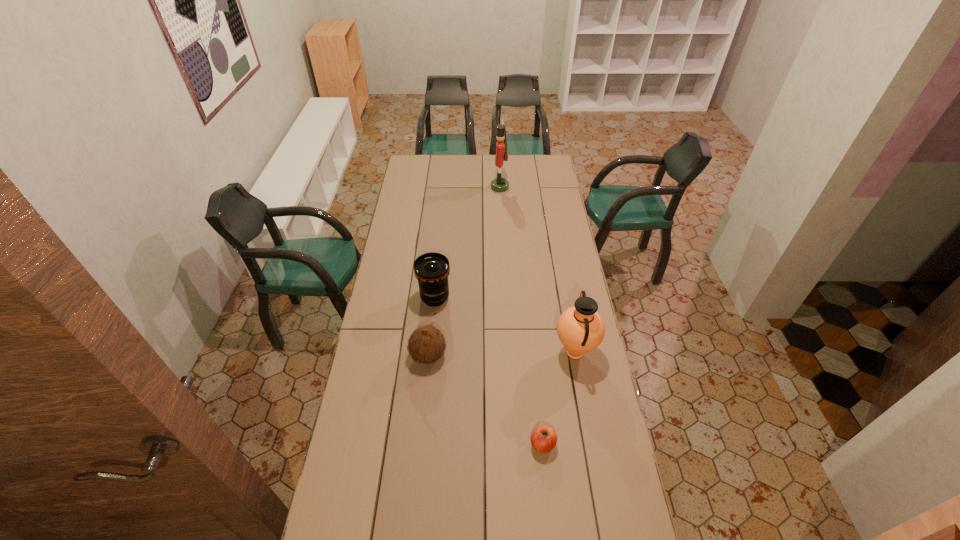
Where is `vacant region located on the front-facing side of the nutcracker`? The height and width of the screenshot is (540, 960). vacant region located on the front-facing side of the nutcracker is located at coordinates (434, 187).

Where is `vacant space located 0.250m on the left of the rightmost object`? The height and width of the screenshot is (540, 960). vacant space located 0.250m on the left of the rightmost object is located at coordinates (490, 353).

At what (x,y) coordinates should I click in order to perform the action: click on vacant position located on the surface of the coconut. Please return your answer as a coordinate pair (x, y). This screenshot has height=540, width=960. Looking at the image, I should click on (418, 461).

This screenshot has width=960, height=540. Find the location of `free region located on the left of the telephoto lens`. free region located on the left of the telephoto lens is located at coordinates (396, 298).

The image size is (960, 540). I want to click on free space located on the back of the nearest object, so click(538, 396).

Where is `object that is at the right edge`? object that is at the right edge is located at coordinates (580, 328).

You are a GUI agent. You are given a task and a screenshot of the screen. Output one action in this format:
    pyautogui.click(x=<x>, y=<y>)
    Task: Click on the vacant space at the left edge of the desktop
    The width and height of the screenshot is (960, 540).
    Given the screenshot: What is the action you would take?
    pyautogui.click(x=416, y=199)

Where is `free space at the right edge`? free space at the right edge is located at coordinates (567, 379).

In the image, there is a desktop. Where is `free space at the far left corner`? This screenshot has height=540, width=960. free space at the far left corner is located at coordinates (408, 159).

At what (x,y) coordinates should I click in order to perform the action: click on unoccupied position between the nearest object and the coconut. Please return your answer as a coordinate pair (x, y). The image size is (960, 540). Looking at the image, I should click on (486, 400).